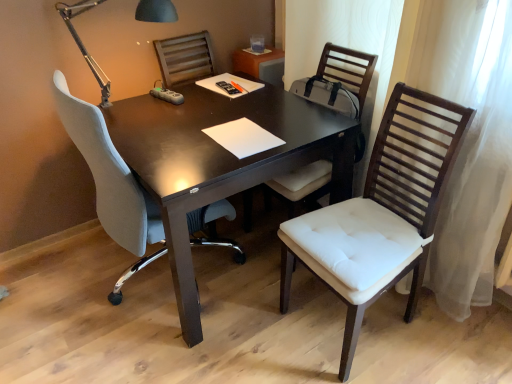
Locate an element on the screen. The height and width of the screenshot is (384, 512). free spot in front of white fabric chair at left, which is the 1th chair from left to right is located at coordinates (157, 356).